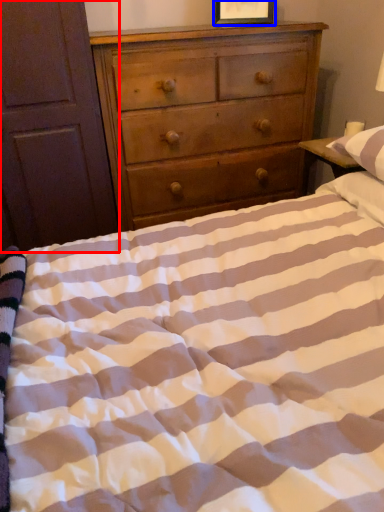
Question: Which object is further to the camera taking this photo, armoire (highlighted by a red box) or picture frame (highlighted by a blue box)?

Choices:
 (A) armoire
 (B) picture frame

Answer: (B)